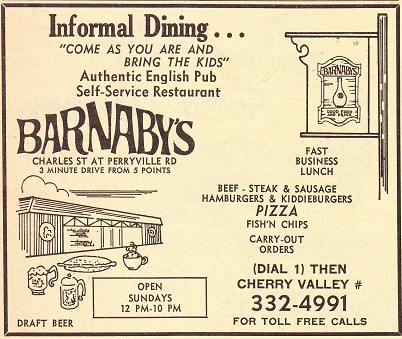
Where is `authentic english pub`? authentic english pub is located at coordinates (144, 74).